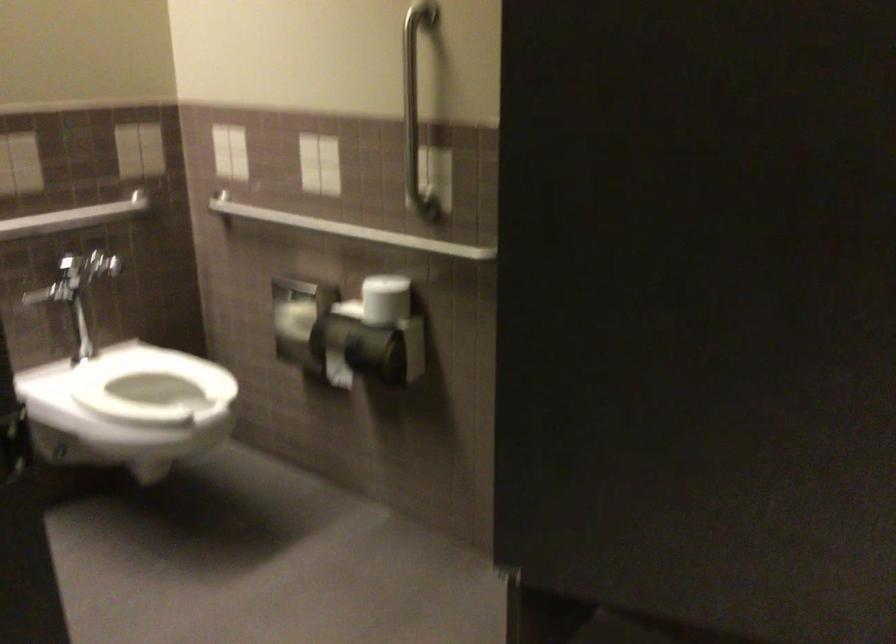
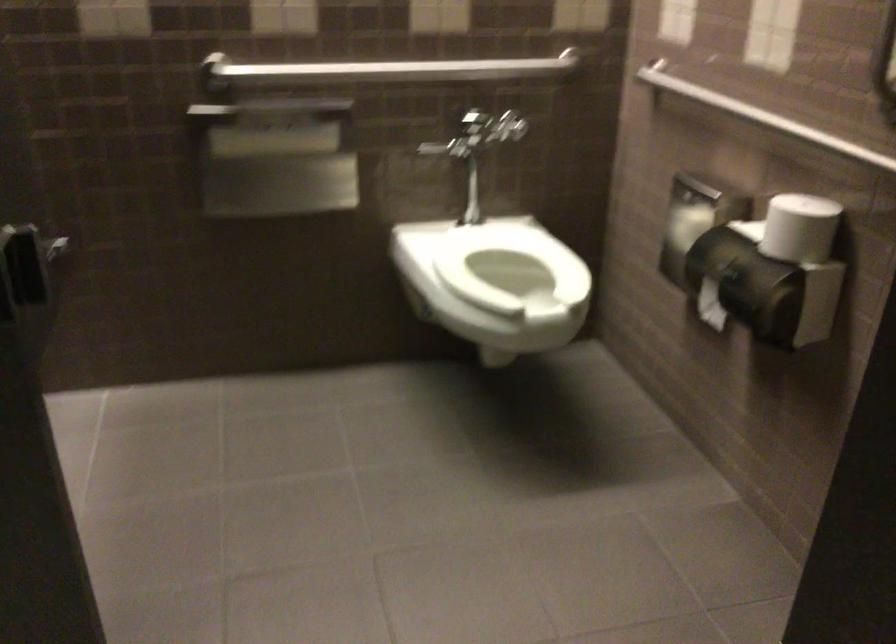
Find the pixel in the second image that matches (337,223) in the first image.

(761, 116)